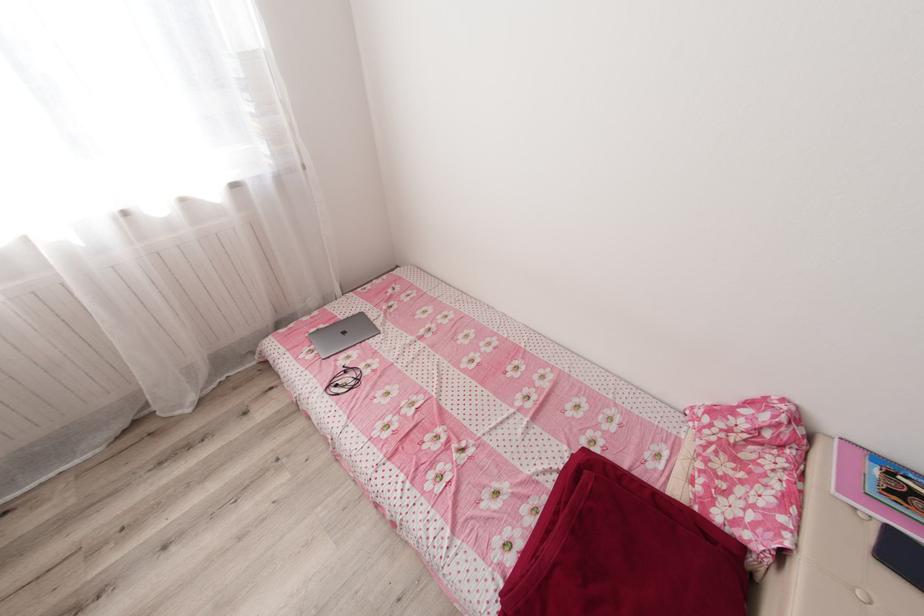
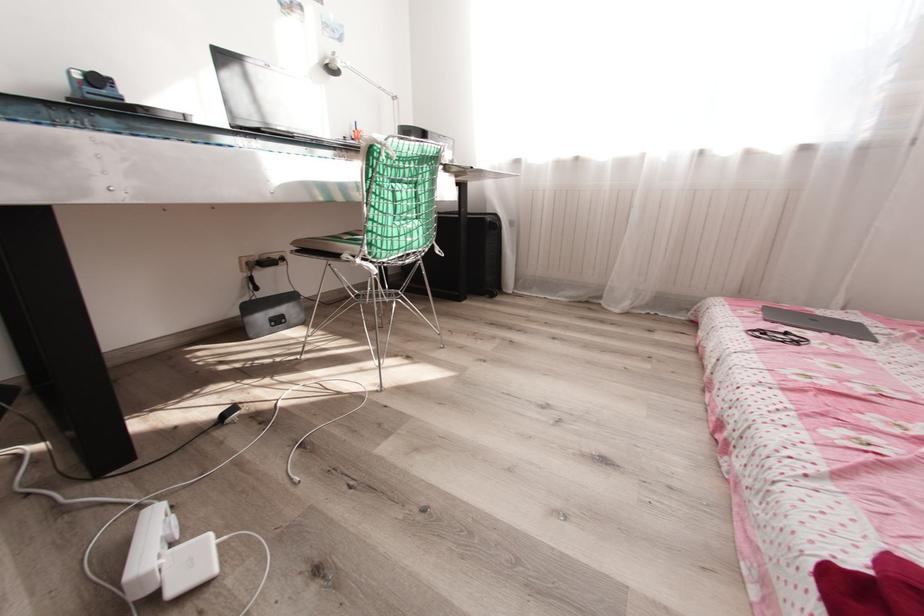
Question: The camera is either moving clockwise (left) or counter-clockwise (right) around the object. The first image is from the beginning of the video and the second image is from the end. Is the camera moving left or right when shooting the video?

Choices:
 (A) Left
 (B) Right

Answer: (B)